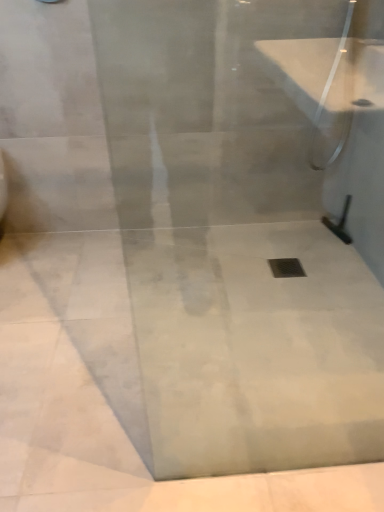
Question: In the image, is black rubber squeegee at right, which is the first shower in bottom-to-top order, on the left side or the right side of metallic silver drain at center?

Choices:
 (A) left
 (B) right

Answer: (B)

Question: From the image's perspective, is black rubber squeegee at right, which is the first shower in bottom-to-top order, positioned above or below metallic silver drain at center?

Choices:
 (A) below
 (B) above

Answer: (B)

Question: Considering the real-world distances, which object is closest to the white marble concrete at center?

Choices:
 (A) black rubber squeegee at right, which is the first shower in bottom-to-top order
 (B) metallic silver drain at center
 (C) clear glass shower door at upper right, which ranks as the first shower in top-to-bottom order

Answer: (B)

Question: Which object is positioned farthest from the metallic silver drain at center?

Choices:
 (A) clear glass shower door at upper right, which ranks as the first shower in top-to-bottom order
 (B) white marble concrete at center
 (C) black rubber squeegee at right, marked as the 2th shower in a top-to-bottom arrangement

Answer: (A)